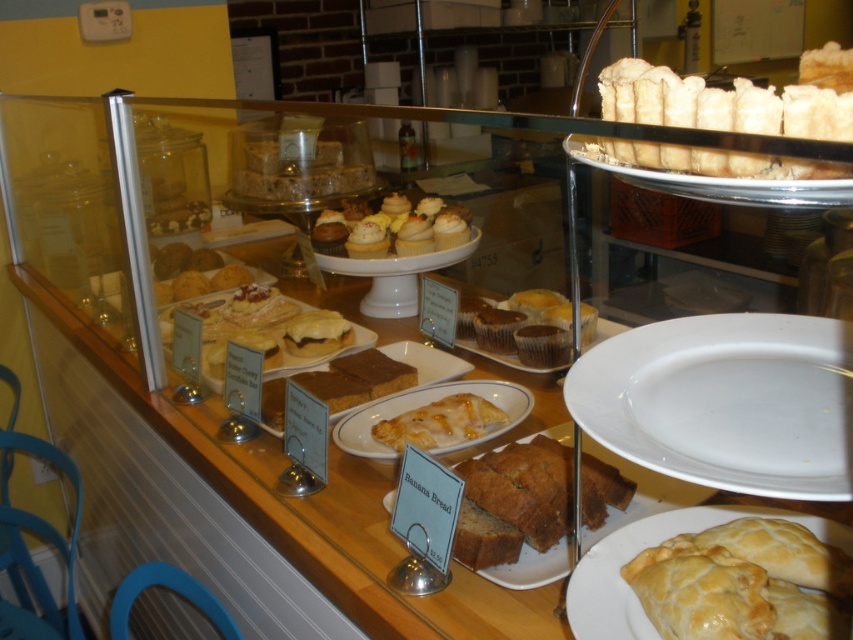
Question: Which of the following is the closest to the observer?

Choices:
 (A) (581, 621)
 (B) (444, 448)
 (C) (386, 262)

Answer: (A)

Question: In this image, where is white ceramic plate at upper right located relative to clear glass plate at center?

Choices:
 (A) below
 (B) above

Answer: (A)

Question: Which object appears closest to the camera in this image?

Choices:
 (A) brown matte banana bread at center
 (B) white ceramic plate at center
 (C) matte white cupcakes at center
 (D) matte white plate at center

Answer: (B)

Question: Which point appears closest to the camera in this image?

Choices:
 (A) (608, 323)
 (B) (827, 93)

Answer: (B)

Question: Is white ceramic plate at center smaller than matte brown plate at center?

Choices:
 (A) yes
 (B) no

Answer: (A)

Question: Is golden brown flaky pastry at upper right further to the viewer compared to matte white cupcakes at center?

Choices:
 (A) yes
 (B) no

Answer: (B)